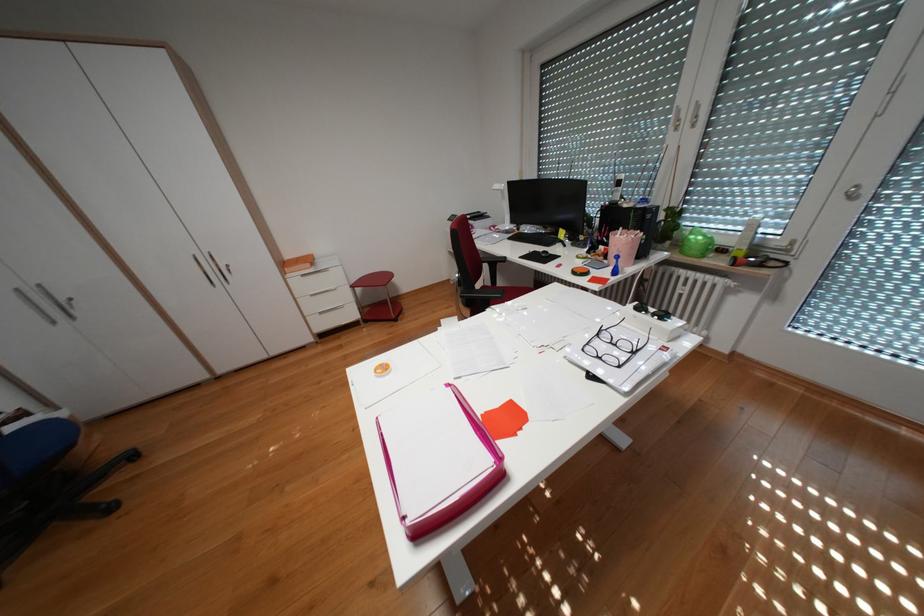
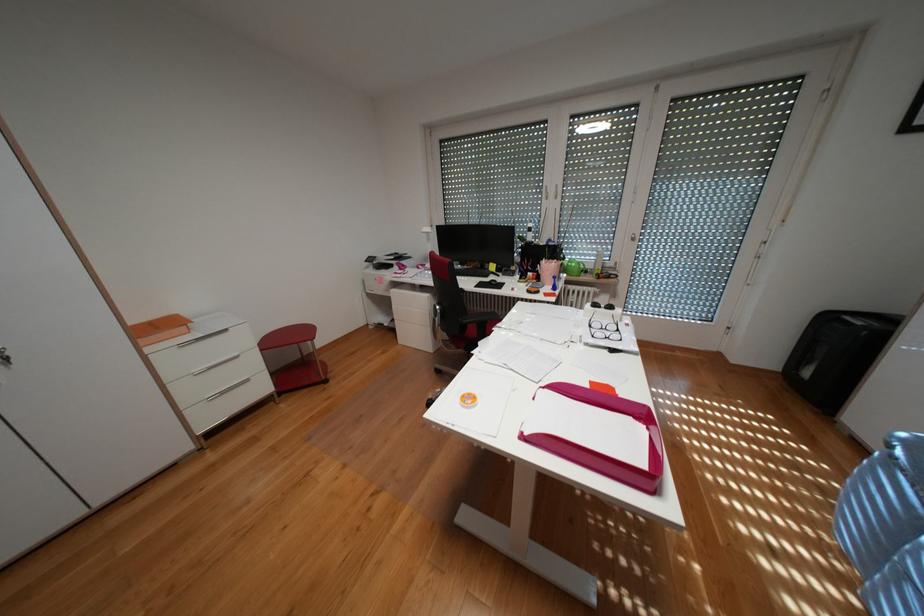
Question: Based on the continuous images, in which direction is the camera rotating? Reply with the corresponding letter.

Choices:
 (A) Left
 (B) Right
 (C) Up
 (D) Down

Answer: (B)